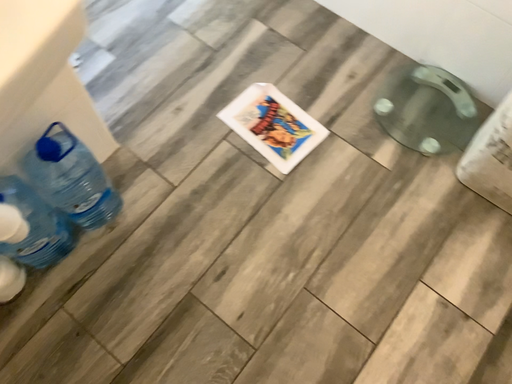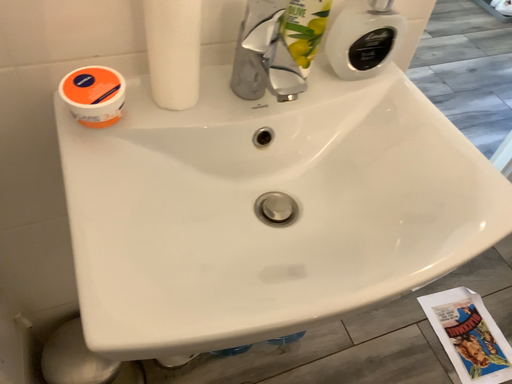
Question: How did the camera likely rotate when shooting the video?

Choices:
 (A) rotated upward
 (B) rotated downward

Answer: (A)